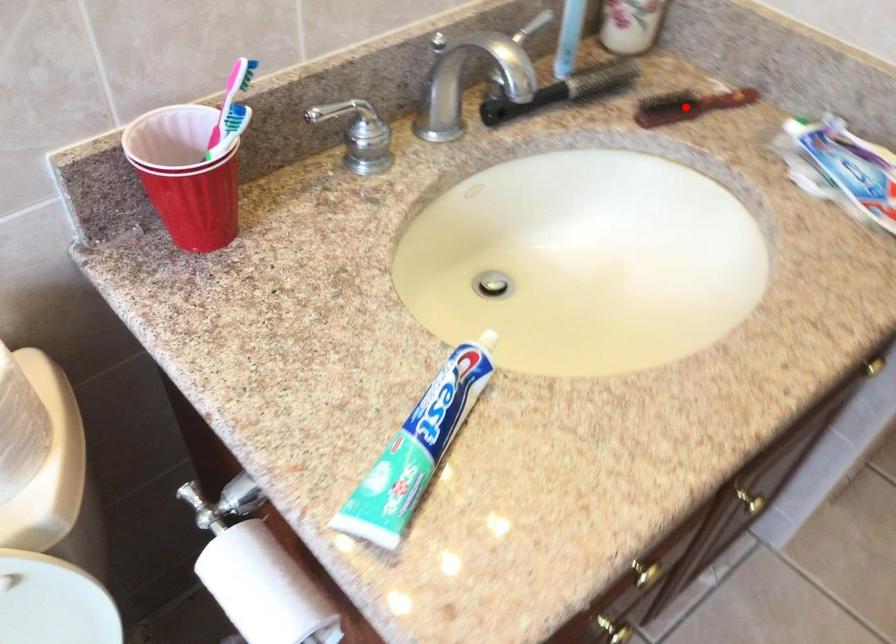
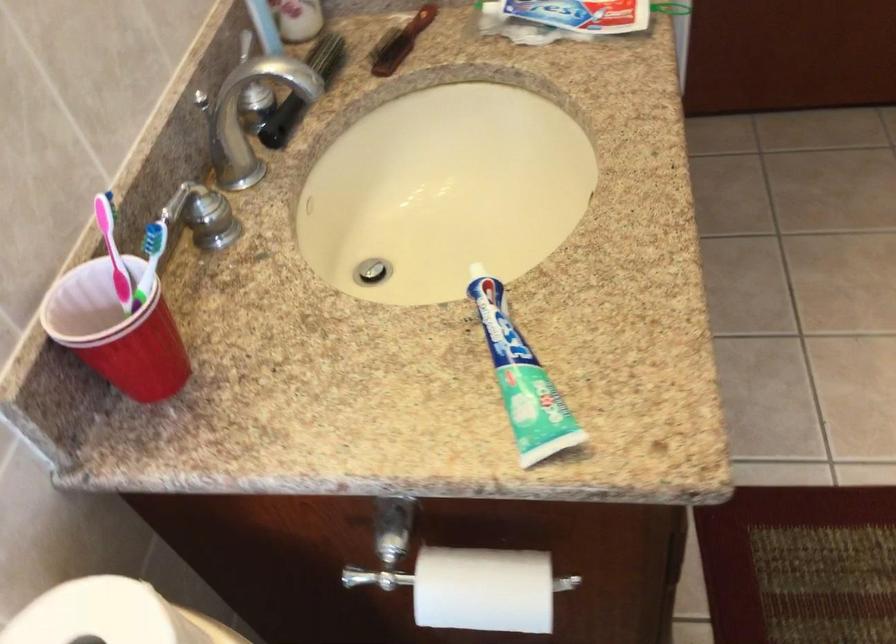
In the second image, find the point that corresponds to the highlighted location in the first image.

(400, 42)